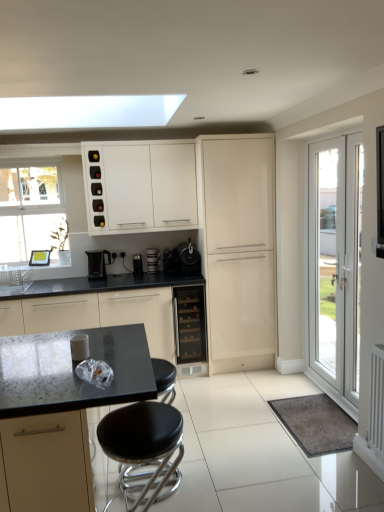
Question: From the image's perspective, is white glossy wine rack at upper center, which is counted as the 4th cabinetry, starting from the front, above metallic black coffee machine at center?

Choices:
 (A) no
 (B) yes

Answer: (B)

Question: Does white glossy wine rack at upper center, which is counted as the 4th cabinetry, starting from the front, have a larger size compared to metallic black coffee machine at center?

Choices:
 (A) no
 (B) yes

Answer: (B)

Question: Is white glossy wine rack at upper center, which is counted as the 4th cabinetry, starting from the front, outside metallic black coffee machine at center?

Choices:
 (A) yes
 (B) no

Answer: (A)

Question: Could you tell me if white glossy wine rack at upper center, which is counted as the first cabinetry, starting from the back, is turned towards metallic black coffee machine at center?

Choices:
 (A) no
 (B) yes

Answer: (A)

Question: Is white glossy wine rack at upper center, which is counted as the 4th cabinetry, starting from the front, to the right of metallic black coffee machine at center from the viewer's perspective?

Choices:
 (A) no
 (B) yes

Answer: (A)

Question: From a real-world perspective, relative to black granite countertop at lower left, acting as the second cabinetry starting from the front, is metallic black coffee machine at center vertically above or below?

Choices:
 (A) above
 (B) below

Answer: (A)

Question: Based on their sizes in the image, would you say metallic black coffee machine at center is bigger or smaller than black granite countertop at lower left, acting as the second cabinetry starting from the front?

Choices:
 (A) big
 (B) small

Answer: (B)

Question: From the image's perspective, is metallic black coffee machine at center located above or below black granite countertop at lower left, acting as the second cabinetry starting from the front?

Choices:
 (A) above
 (B) below

Answer: (A)

Question: From their relative heights in the image, would you say metallic black coffee machine at center is taller or shorter than black granite countertop at lower left, acting as the second cabinetry starting from the front?

Choices:
 (A) short
 (B) tall

Answer: (A)

Question: Is metallic black coffee machine at center inside the boundaries of white glossy door at right, or outside?

Choices:
 (A) inside
 (B) outside

Answer: (B)

Question: Would you say metallic black coffee machine at center is to the left or to the right of white glossy door at right in the picture?

Choices:
 (A) right
 (B) left

Answer: (B)

Question: Considering the positions of metallic black coffee machine at center and white glossy door at right in the image, is metallic black coffee machine at center wider or thinner than white glossy door at right?

Choices:
 (A) thin
 (B) wide

Answer: (B)

Question: Considering the positions of point coord(152,254) and point coord(349,136), is point coord(152,254) closer or farther from the camera than point coord(349,136)?

Choices:
 (A) closer
 (B) farther

Answer: (B)

Question: From their relative heights in the image, would you say white glossy door at right is taller or shorter than black plastic coffee maker at center, marked as the 2th appliance in a right-to-left arrangement?

Choices:
 (A) tall
 (B) short

Answer: (A)

Question: Is white glossy door at right bigger or smaller than black plastic coffee maker at center, marked as the 2th appliance in a right-to-left arrangement?

Choices:
 (A) big
 (B) small

Answer: (A)